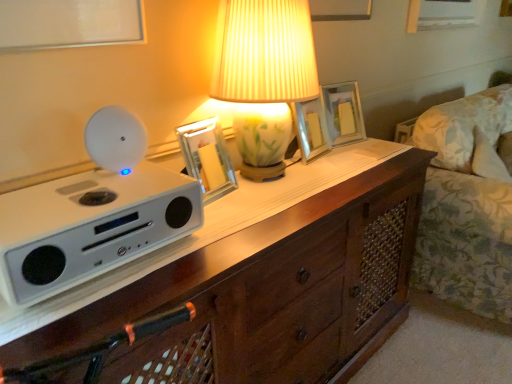
You are a GUI agent. You are given a task and a screenshot of the screen. Output one action in this format:
    pyautogui.click(x=<x>, y=<y>)
    Task: Click on the vacant area that lies in front of metallic silver picture frame at center, the 3th picture frame in the back-to-front sequence
    This screenshot has height=384, width=512.
    Given the screenshot: What is the action you would take?
    pyautogui.click(x=227, y=215)